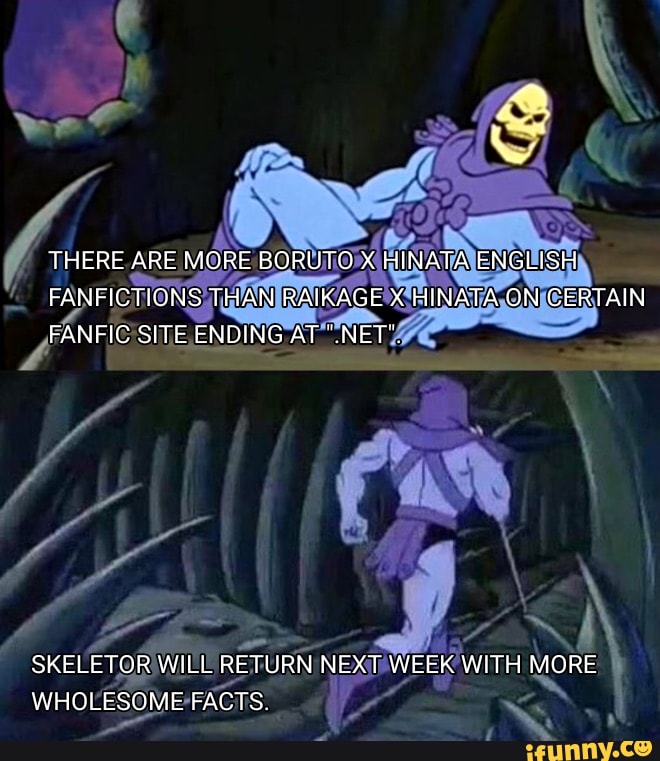
Locate an element on the screen. window is located at coordinates (121, 116).